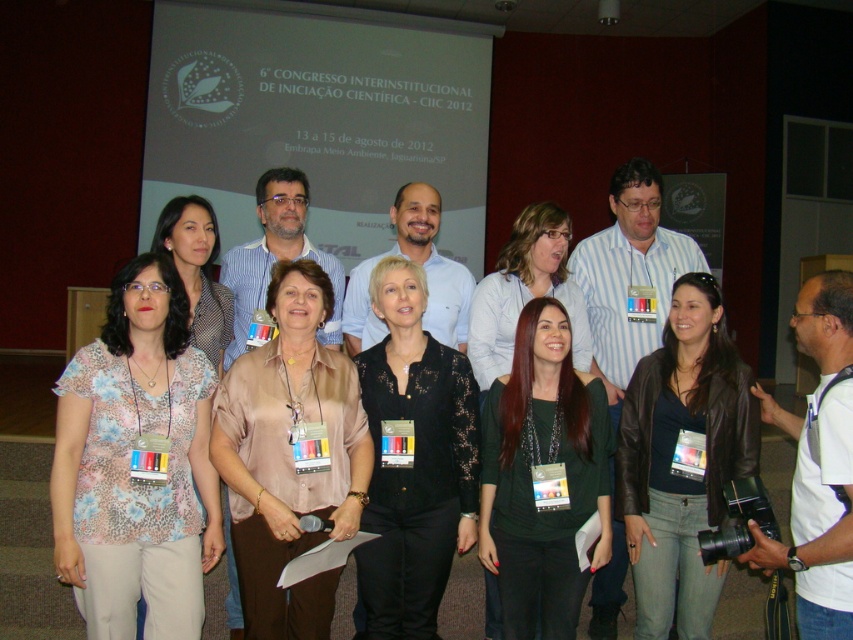
Is white shirt at center further to camera compared to matte brown blouse at center?

No.

Which is more to the right, white shirt at center or matte brown blouse at center?

white shirt at center

Where is `white shirt at center`? The image size is (853, 640). white shirt at center is located at coordinates (817, 465).

Identify the location of white shirt at center. The height and width of the screenshot is (640, 853). tap(817, 465).

Between floral print blouse at center and matte pink blouse at center, which one appears on the left side from the viewer's perspective?

floral print blouse at center is more to the left.

Does floral print blouse at center appear on the left side of matte pink blouse at center?

Correct, you'll find floral print blouse at center to the left of matte pink blouse at center.

Image resolution: width=853 pixels, height=640 pixels. What do you see at coordinates (131, 460) in the screenshot?
I see `floral print blouse at center` at bounding box center [131, 460].

This screenshot has height=640, width=853. I want to click on floral print blouse at center, so click(x=131, y=460).

Which is above, black lace blouse at center or matte floral blouse at lower left?

matte floral blouse at lower left is higher up.

Does black lace blouse at center have a larger size compared to matte floral blouse at lower left?

Incorrect, black lace blouse at center is not larger than matte floral blouse at lower left.

What do you see at coordinates (413, 460) in the screenshot?
I see `black lace blouse at center` at bounding box center [413, 460].

Locate an element on the screen. The height and width of the screenshot is (640, 853). black lace blouse at center is located at coordinates (413, 460).